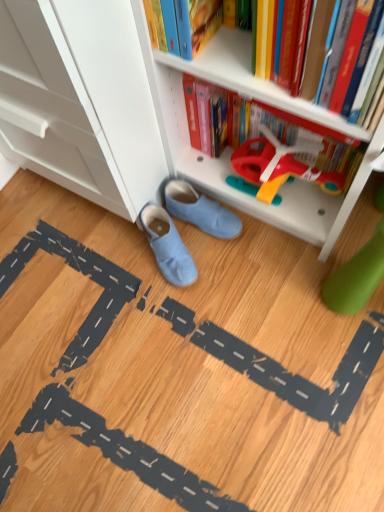
Question: From the image's perspective, is hardcover book at upper center positioned above or below white plastic bookcase at lower center?

Choices:
 (A) below
 (B) above

Answer: (B)

Question: Does point (336, 114) appear closer or farther from the camera than point (284, 196)?

Choices:
 (A) closer
 (B) farther

Answer: (A)

Question: Which of these objects is positioned closest to the hardcover book at upper center?

Choices:
 (A) suede-like blue slippers at center, the 2th footwear in the bottom-to-top sequence
 (B) light blue suede shoes at center, which appears as the second footwear when viewed from the top
 (C) white plastic bookcase at lower center

Answer: (C)

Question: Considering the real-world distances, which object is farthest from the light blue suede shoes at center, which appears as the second footwear when viewed from the top?

Choices:
 (A) hardcover book at upper center
 (B) suede-like blue slippers at center, the first footwear when ordered from top to bottom
 (C) white plastic bookcase at lower center

Answer: (A)